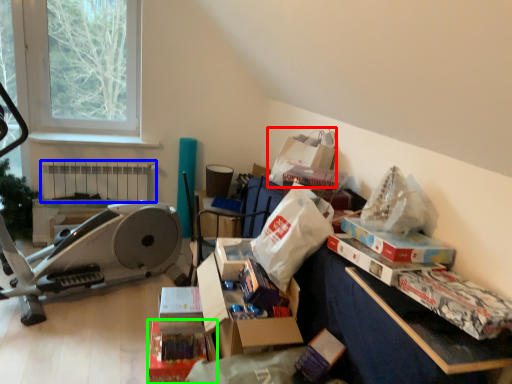
Question: Which object is positioned closest to paper bag (highlighted by a red box)? Select from radiator (highlighted by a blue box) and storage box (highlighted by a green box).

Choices:
 (A) radiator
 (B) storage box

Answer: (B)